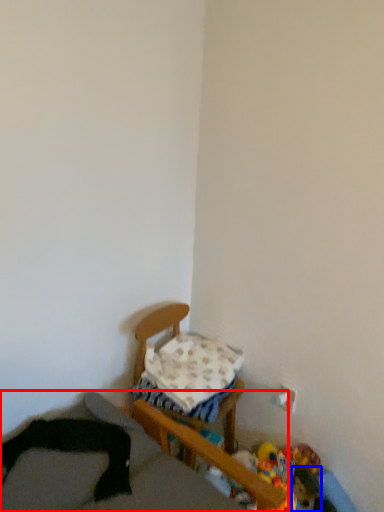
Question: Which point is further to the camera, furniture (highlighted by a red box) or toy (highlighted by a blue box)?

Choices:
 (A) furniture
 (B) toy

Answer: (B)